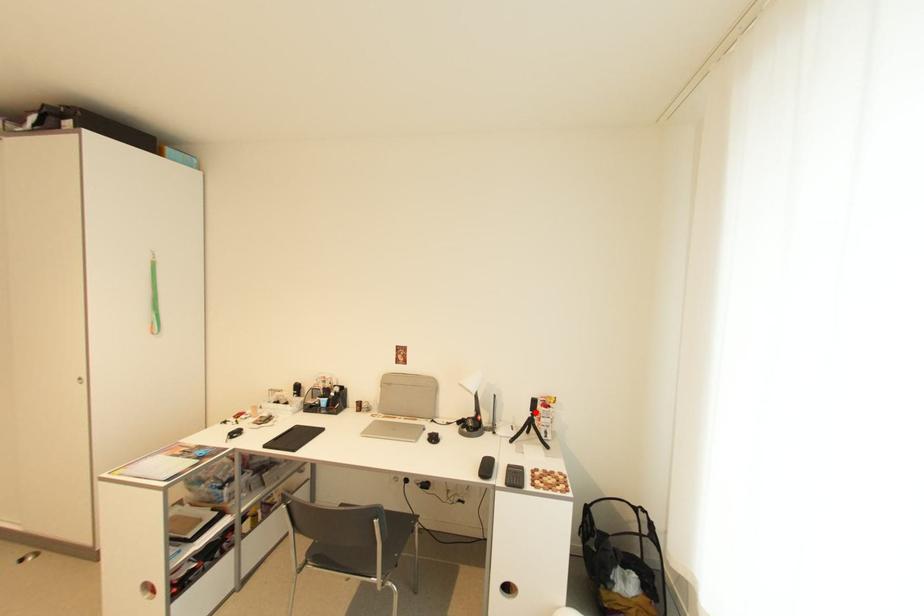
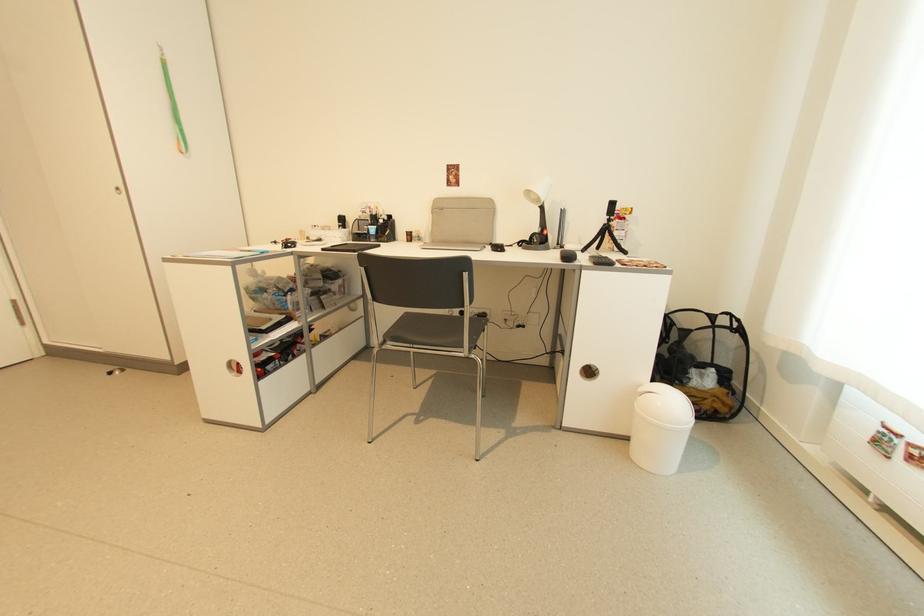
Where in the second image is the point corresponding to the highlighted location from the first image?

(612, 217)